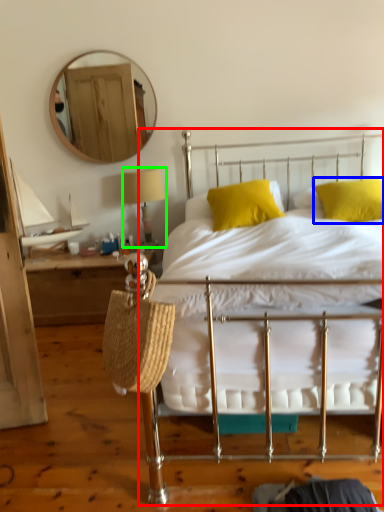
Question: Considering the real-world distances, which object is farthest from bed (highlighted by a red box)? pillow (highlighted by a blue box) or table lamp (highlighted by a green box)?

Choices:
 (A) pillow
 (B) table lamp

Answer: (B)